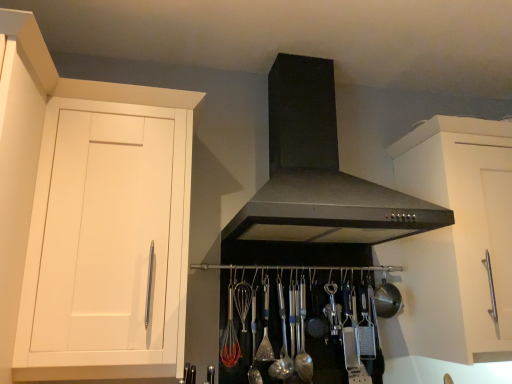
Question: Is satin silver spoon at center, marked as the 1th utensil in a left-to-right arrangement, smaller than satin silver spoon at center, the 1th utensil when ordered from right to left?

Choices:
 (A) no
 (B) yes

Answer: (A)

Question: From a real-world perspective, is satin silver spoon at center, marked as the 4th utensil in a right-to-left arrangement, physically below satin silver spoon at center, the 4th utensil from the left?

Choices:
 (A) yes
 (B) no

Answer: (A)

Question: Does satin silver spoon at center, marked as the 1th utensil in a left-to-right arrangement, have a lesser height compared to satin silver spoon at center, the 4th utensil from the left?

Choices:
 (A) no
 (B) yes

Answer: (A)

Question: Is satin silver spoon at center, marked as the 1th utensil in a left-to-right arrangement, bigger than satin silver spoon at center, the 1th utensil when ordered from right to left?

Choices:
 (A) yes
 (B) no

Answer: (A)

Question: Is satin silver spoon at center, marked as the 4th utensil in a right-to-left arrangement, far away from satin silver spoon at center, the 1th utensil when ordered from right to left?

Choices:
 (A) no
 (B) yes

Answer: (A)

Question: From a real-world perspective, is black matte fume hood at center positioned above or below satin silver spoon at center, the 1th utensil when ordered from right to left?

Choices:
 (A) below
 (B) above

Answer: (B)

Question: Looking at their shapes, would you say black matte fume hood at center is wider or thinner than satin silver spoon at center, the 4th utensil from the left?

Choices:
 (A) wide
 (B) thin

Answer: (A)

Question: In the image, is black matte fume hood at center positioned in front of or behind satin silver spoon at center, the 1th utensil when ordered from right to left?

Choices:
 (A) behind
 (B) front

Answer: (B)

Question: Considering the positions of point (387, 188) and point (298, 372), is point (387, 188) closer or farther from the camera than point (298, 372)?

Choices:
 (A) closer
 (B) farther

Answer: (A)

Question: Is satin silver spoon at center, the 4th utensil from the left, taller or shorter than white matte cabinet at right, the first cabinetry positioned from the right?

Choices:
 (A) short
 (B) tall

Answer: (A)

Question: Is satin silver spoon at center, the 4th utensil from the left, wider or thinner than white matte cabinet at right, the first cabinetry positioned from the right?

Choices:
 (A) wide
 (B) thin

Answer: (B)

Question: Is satin silver spoon at center, the 4th utensil from the left, bigger or smaller than white matte cabinet at right, arranged as the second cabinetry when viewed from the left?

Choices:
 (A) big
 (B) small

Answer: (B)

Question: Is satin silver spoon at center, the 1th utensil when ordered from right to left, to the left or to the right of white matte cabinet at right, the first cabinetry positioned from the right, in the image?

Choices:
 (A) left
 (B) right

Answer: (A)

Question: Looking at their shapes, would you say white matte cabinet at left, which is the 2th cabinetry from right to left, is wider or thinner than satin silver spoon at center, which appears as the second utensil when viewed from the right?

Choices:
 (A) thin
 (B) wide

Answer: (B)

Question: From a real-world perspective, is white matte cabinet at left, which is the 2th cabinetry from right to left, above or below satin silver spoon at center, placed as the third utensil when sorted from left to right?

Choices:
 (A) below
 (B) above

Answer: (B)